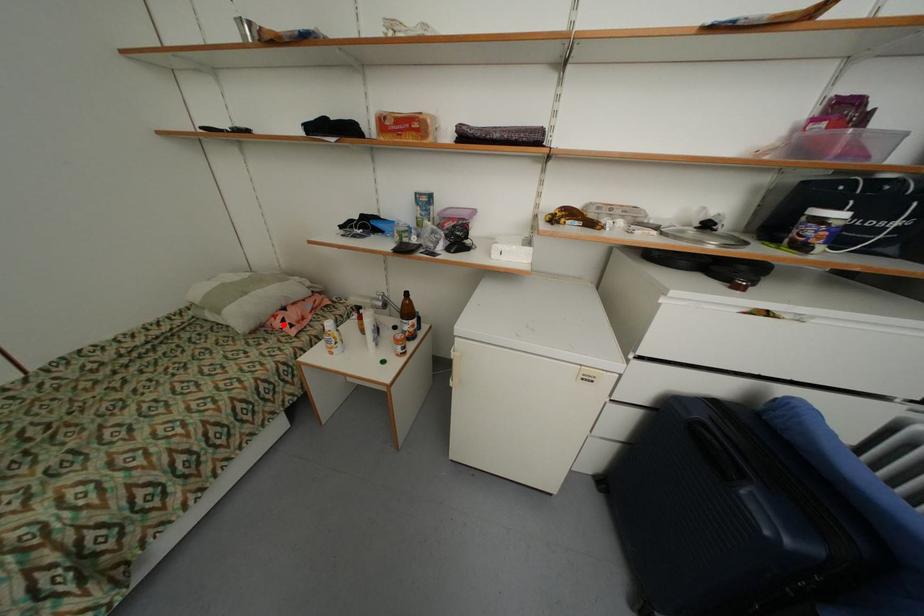
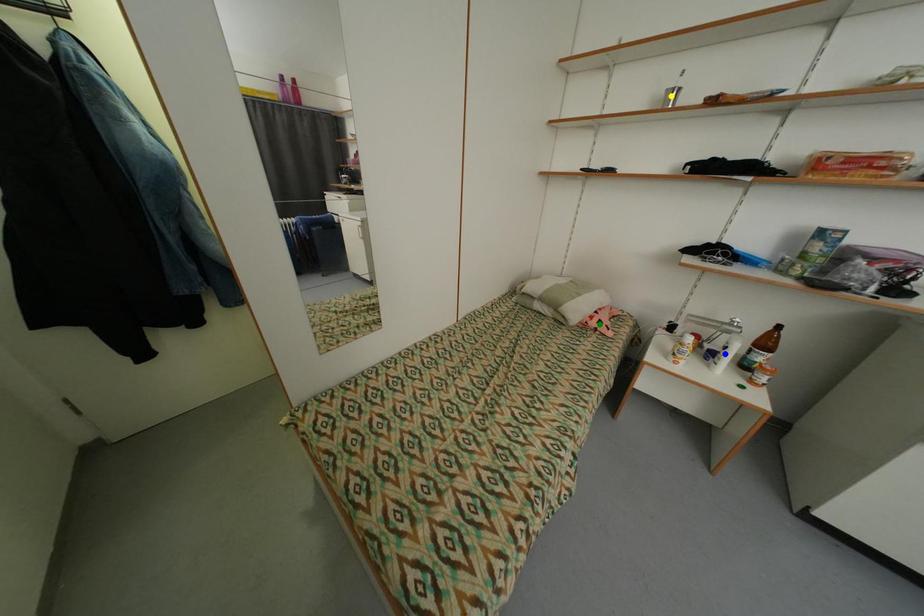
Question: I am providing you with two images of the same scene from different viewpoints. A red point is marked on the first image. You are given multiple points on the second image. Which mark in image 2 goes with the point in image 1?

Choices:
 (A) green point
 (B) blue point
 (C) yellow point

Answer: (A)